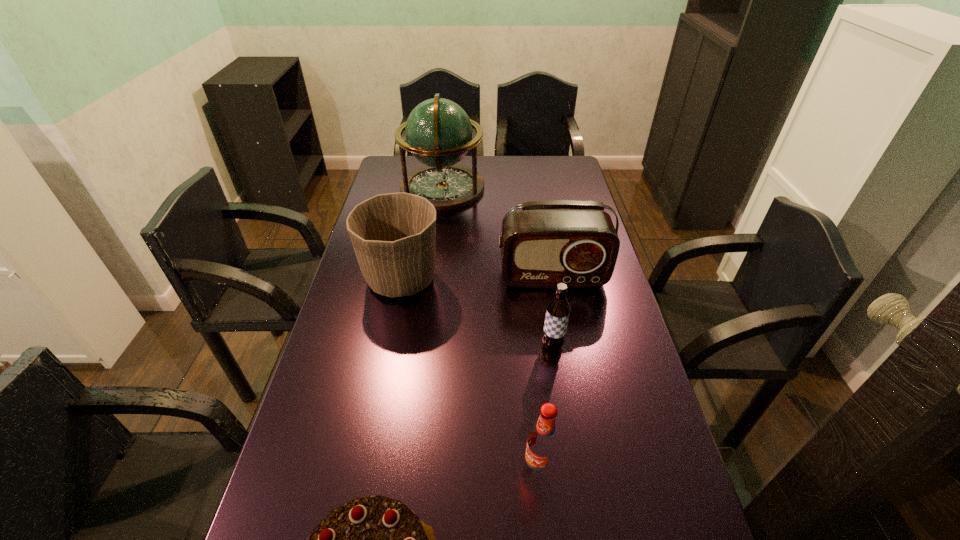
At what (x,y) coordinates should I click in order to perform the action: click on vacant region located on the front of the flowerpot. Please return your answer as a coordinate pair (x, y). The image size is (960, 540). Looking at the image, I should click on (382, 380).

The image size is (960, 540). I want to click on vacant space located 0.260m on the back of the left root beer, so click(527, 358).

Where is `vacant area situated on the left of the third nearest object`? This screenshot has height=540, width=960. vacant area situated on the left of the third nearest object is located at coordinates (451, 346).

Find the location of a particular element. The height and width of the screenshot is (540, 960). object located in the far edge section of the desktop is located at coordinates (438, 132).

This screenshot has height=540, width=960. I want to click on globe located at the left edge, so (438, 132).

This screenshot has height=540, width=960. In order to click on flowerpot that is positioned at the left edge in this screenshot , I will do `click(393, 235)`.

Find the location of a particular element. object that is at the right edge is located at coordinates click(548, 242).

Where is `object that is at the far left corner`? object that is at the far left corner is located at coordinates (438, 132).

Where is `blank space at the far edge of the desktop`? This screenshot has height=540, width=960. blank space at the far edge of the desktop is located at coordinates (494, 162).

You are a GUI agent. You are given a task and a screenshot of the screen. Output one action in this format:
    pyautogui.click(x=<x>, y=<y>)
    Task: Click on the free location at the left edge of the desktop
    Image resolution: width=960 pixels, height=540 pixels.
    Given the screenshot: What is the action you would take?
    pyautogui.click(x=354, y=292)